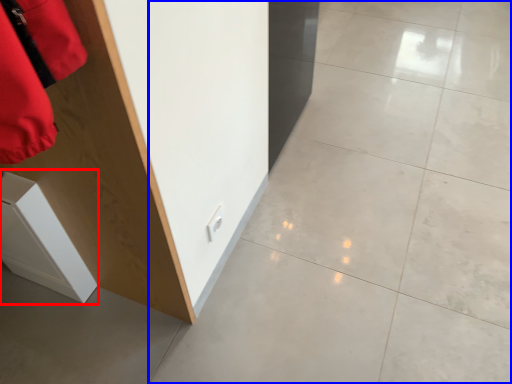
Question: Which object is closer to the camera taking this photo, cabinetry (highlighted by a red box) or concrete (highlighted by a blue box)?

Choices:
 (A) cabinetry
 (B) concrete

Answer: (B)